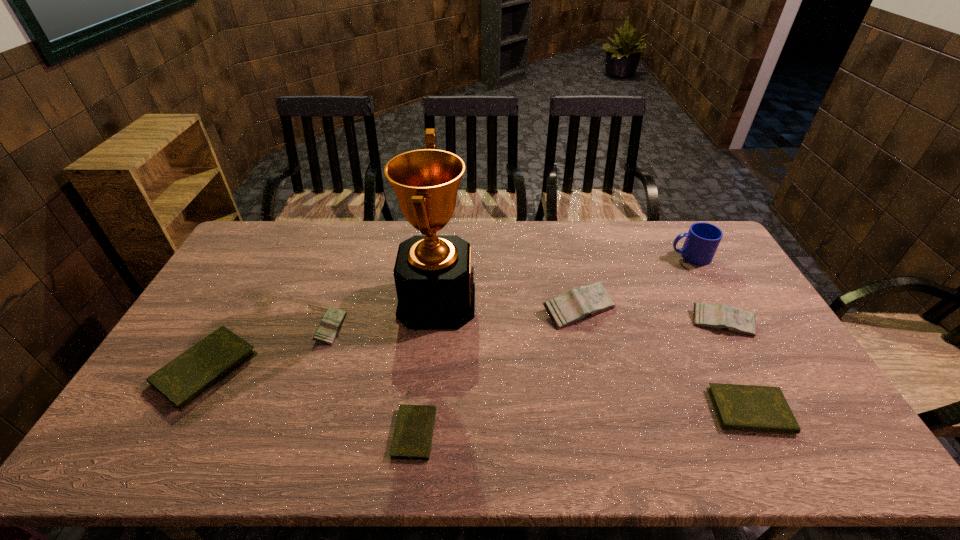
Where is `free space between the second green diary from right to left and the mug`? The height and width of the screenshot is (540, 960). free space between the second green diary from right to left and the mug is located at coordinates (552, 345).

Locate an element on the screen. The width and height of the screenshot is (960, 540). free spot between the seventh tallest object and the fourth tallest object is located at coordinates (736, 367).

The width and height of the screenshot is (960, 540). What are the coordinates of `free spot between the shortest object and the fifth shortest object` in the screenshot? It's located at (568, 378).

Locate an element on the screen. blank region between the mug and the fourth diary from left to right is located at coordinates (635, 282).

Locate an element on the screen. This screenshot has width=960, height=540. object that is the sixth closest to the leftmost green diary is located at coordinates (716, 316).

Find the location of a particular element. This screenshot has height=540, width=960. object identified as the sixth closest to the trophy cup is located at coordinates (716, 316).

Point out which diary is positioned as the third nearest to the fourth tallest object. Please provide its 2D coordinates. Your answer should be formatted as a tuple, i.e. [(x, y)], where the tuple contains the x and y coordinates of a point satisfying the conditions above.

[(412, 439)]

Locate an element on the screen. diary object that ranks as the second closest to the second diary from left to right is located at coordinates (412, 439).

Where is `pink diary that stands as the second closest to the gold trophy cup`? This screenshot has width=960, height=540. pink diary that stands as the second closest to the gold trophy cup is located at coordinates (578, 304).

Select which pink diary is the closest to the third tallest object. Please provide its 2D coordinates. Your answer should be formatted as a tuple, i.e. [(x, y)], where the tuple contains the x and y coordinates of a point satisfying the conditions above.

[(716, 316)]